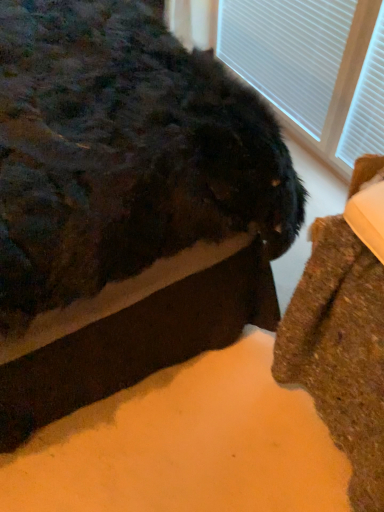
Question: From a real-world perspective, relative to brown textured rug at lower right, is white textured blinds at upper right vertically above or below?

Choices:
 (A) below
 (B) above

Answer: (B)

Question: Based on their sizes in the image, would you say white textured blinds at upper right is bigger or smaller than brown textured rug at lower right?

Choices:
 (A) small
 (B) big

Answer: (A)

Question: Which is farther from the brown textured rug at lower right?

Choices:
 (A) white textured blinds at upper right
 (B) fuzzy black cat at lower right

Answer: (A)

Question: Estimate the real-world distances between objects in this image. Which object is farther from the white textured blinds at upper right?

Choices:
 (A) brown textured rug at lower right
 (B) fuzzy black cat at lower right

Answer: (A)